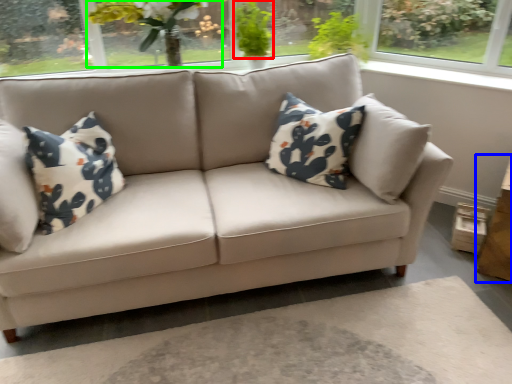
Question: Which object is the farthest from plant (highlighted by a red box)? Choose among these: table (highlighted by a blue box) or floral arrangement (highlighted by a green box).

Choices:
 (A) table
 (B) floral arrangement

Answer: (A)